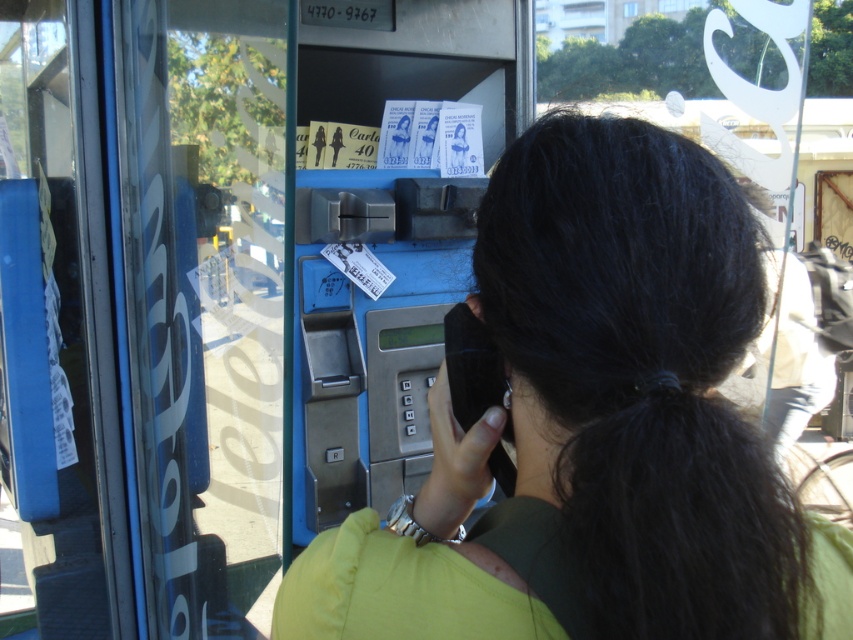
Question: Which of the following is the closest to the observer?

Choices:
 (A) (318, 592)
 (B) (338, 464)

Answer: (A)

Question: Can you confirm if green fabric shirt at center is wider than blue metallic phone box at center?

Choices:
 (A) yes
 (B) no

Answer: (A)

Question: Is the position of green fabric shirt at center less distant than that of blue metallic phone box at center?

Choices:
 (A) no
 (B) yes

Answer: (B)

Question: Which point appears farthest from the camera in this image?

Choices:
 (A) (643, 598)
 (B) (450, 276)

Answer: (B)

Question: Where is green fabric shirt at center located in relation to blue metallic phone box at center in the image?

Choices:
 (A) above
 (B) below

Answer: (B)